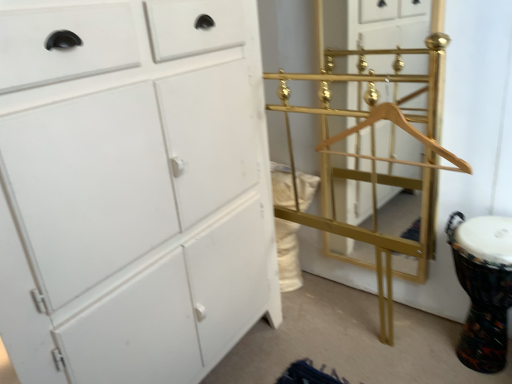
Question: Can you see gold metallic coat rack at center touching white matte cabinet at left?

Choices:
 (A) yes
 (B) no

Answer: (B)

Question: Is gold metallic coat rack at center shorter than white matte cabinet at left?

Choices:
 (A) no
 (B) yes

Answer: (B)

Question: Can we say gold metallic coat rack at center lies outside white matte cabinet at left?

Choices:
 (A) no
 (B) yes

Answer: (B)

Question: Does gold metallic coat rack at center have a greater height compared to white matte cabinet at left?

Choices:
 (A) no
 (B) yes

Answer: (A)

Question: Considering the relative sizes of gold metallic coat rack at center and white matte cabinet at left in the image provided, is gold metallic coat rack at center thinner than white matte cabinet at left?

Choices:
 (A) yes
 (B) no

Answer: (A)

Question: Based on their sizes in the image, would you say multicolored fabric drum at lower right is bigger or smaller than gold metallic bunk bed at right?

Choices:
 (A) small
 (B) big

Answer: (B)

Question: Visually, is multicolored fabric drum at lower right positioned to the left or to the right of gold metallic bunk bed at right?

Choices:
 (A) right
 (B) left

Answer: (A)

Question: From the image's perspective, is multicolored fabric drum at lower right positioned above or below gold metallic bunk bed at right?

Choices:
 (A) below
 (B) above

Answer: (A)

Question: Is multicolored fabric drum at lower right spatially inside gold metallic bunk bed at right, or outside of it?

Choices:
 (A) inside
 (B) outside

Answer: (B)

Question: Is gold metallic coat rack at center in front of or behind multicolored fabric drum at lower right in the image?

Choices:
 (A) behind
 (B) front

Answer: (A)

Question: Which is correct: gold metallic coat rack at center is inside multicolored fabric drum at lower right, or outside of it?

Choices:
 (A) inside
 (B) outside

Answer: (B)

Question: From the image's perspective, is gold metallic coat rack at center positioned above or below multicolored fabric drum at lower right?

Choices:
 (A) above
 (B) below

Answer: (A)

Question: Looking at the image, does gold metallic coat rack at center seem bigger or smaller compared to multicolored fabric drum at lower right?

Choices:
 (A) big
 (B) small

Answer: (B)

Question: Choose the correct answer: Is white matte cabinet at left inside multicolored fabric drum at lower right or outside it?

Choices:
 (A) outside
 (B) inside

Answer: (A)

Question: Visually, is white matte cabinet at left positioned to the left or to the right of multicolored fabric drum at lower right?

Choices:
 (A) right
 (B) left

Answer: (B)